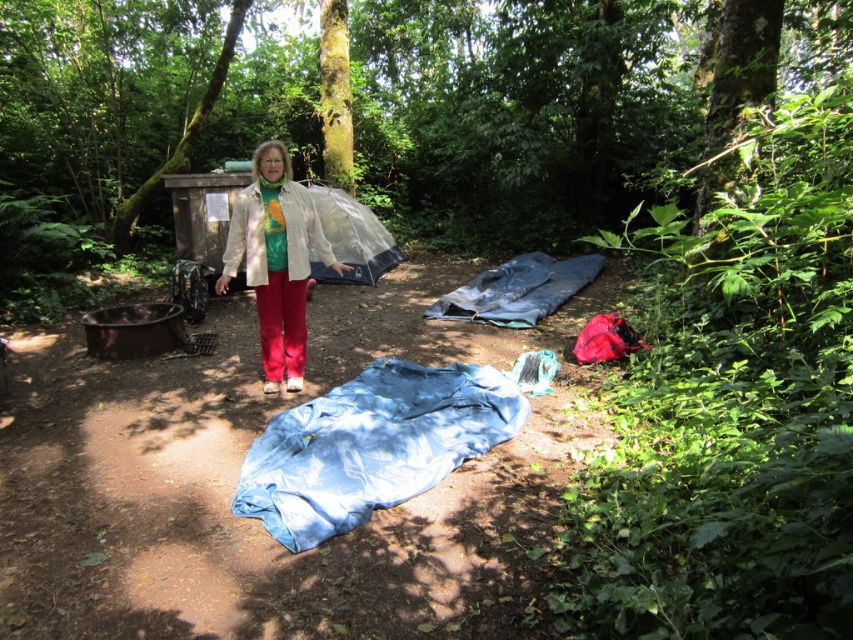
You are setting up a campsite and need to place your light beige jacket at center. Where should you place it relative to the blue tarp at center?

The blue tarp at center is positioned on the right side of the light beige jacket at center, so you should place the light beige jacket at center to the left of the blue tarp at center.

You are a hiker who wants to place a small tent between the two points marked as point (428, 369) and point (285, 280). Based on the camping scene, which point should the tent be closer to if you want it to be sheltered from the direct sunlight?

The tent should be placed closer to point (285, 280) because point (428, 369) is behind it, and since the scene has sunlight filtering through the canopy, placing the tent closer to the front point would provide more shade.